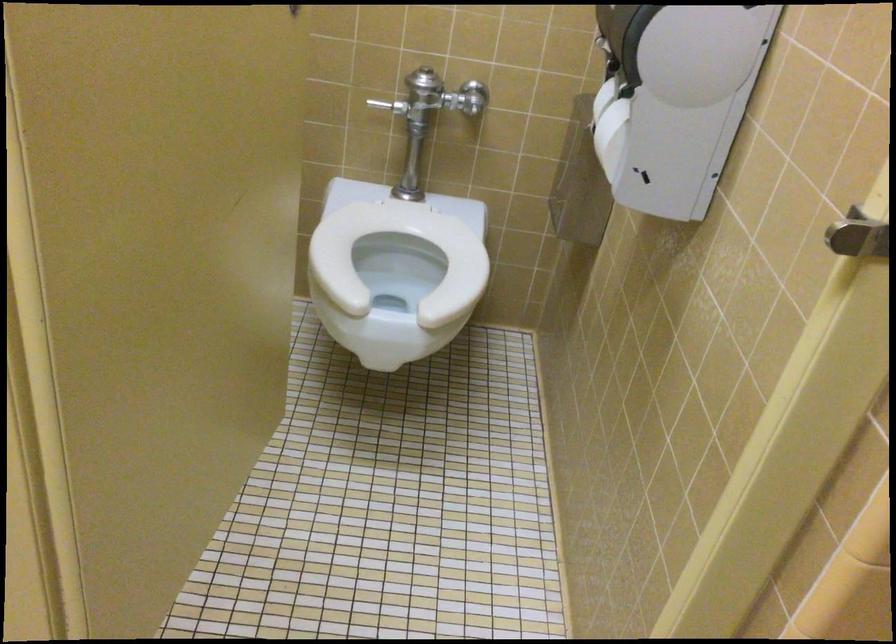
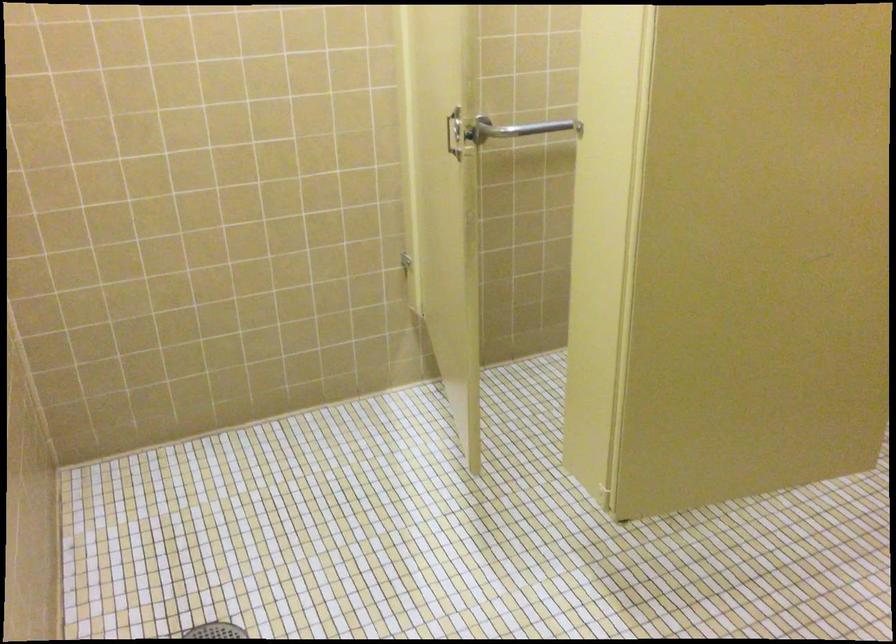
Question: The images are taken continuously from a first-person perspective. In which direction is your viewpoint rotating?

Choices:
 (A) Left
 (B) Right
 (C) Up
 (D) Down

Answer: (A)